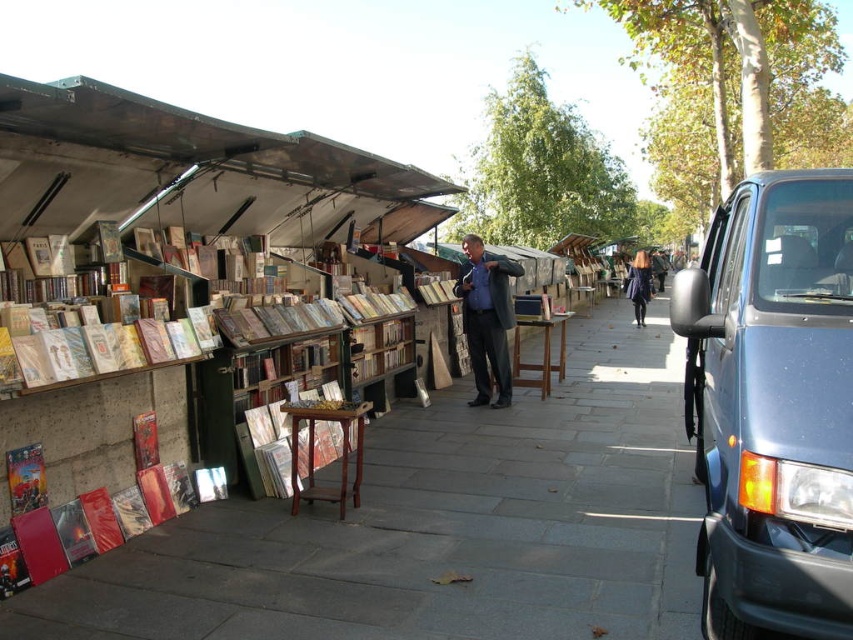
You are a customer at the book market and want to buy both the red glossy book at lower left and the dark blue coat at center. However, you have a small backpack with limited space. Which item should you pick first to ensure it fits in your backpack?

The red glossy book at lower left has a smaller size compared to the dark blue coat at center, so you should pick the red glossy book at lower left first to ensure it fits in your backpack.